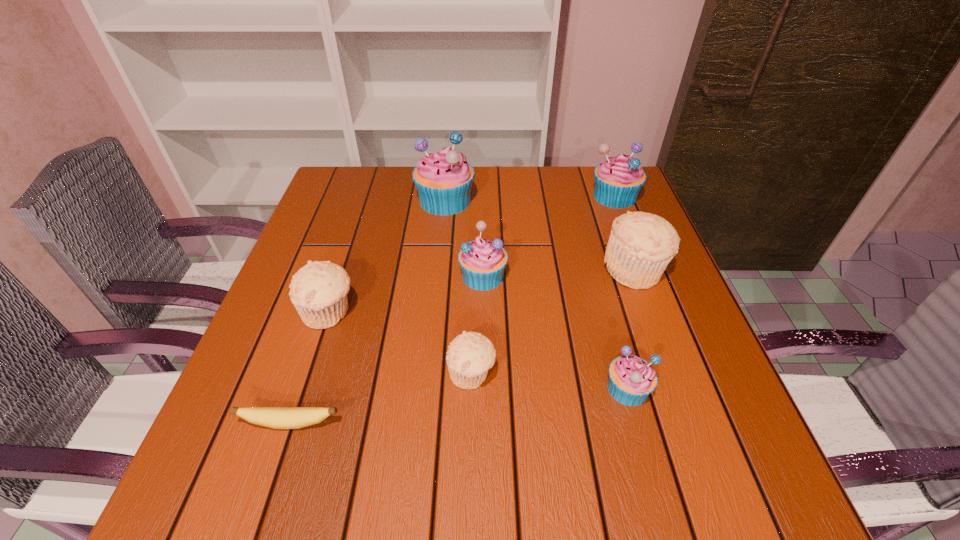
Select which muffin is the third closest to the biggest blue muffin. Please provide its 2D coordinates. Your answer should be formatted as a tuple, i.e. [(x, y)], where the tuple contains the x and y coordinates of a point satisfying the conditions above.

[(641, 245)]

Identify which muffin is located as the fourth nearest to the nearest blue muffin. Please provide its 2D coordinates. Your answer should be formatted as a tuple, i.e. [(x, y)], where the tuple contains the x and y coordinates of a point satisfying the conditions above.

[(318, 291)]

Locate which blue muffin is the closest to the tallest muffin. Please provide its 2D coordinates. Your answer should be formatted as a tuple, i.e. [(x, y)], where the tuple contains the x and y coordinates of a point satisfying the conditions above.

[(482, 262)]

Where is `blue muffin that is the third closest one to the second beige muffin from left to right`? The width and height of the screenshot is (960, 540). blue muffin that is the third closest one to the second beige muffin from left to right is located at coordinates (443, 179).

The image size is (960, 540). What are the coordinates of `the second closest beige muffin to the leftmost muffin` in the screenshot? It's located at (641, 245).

Locate which beige muffin is the closest to the second biggest beige muffin. Please provide its 2D coordinates. Your answer should be formatted as a tuple, i.e. [(x, y)], where the tuple contains the x and y coordinates of a point satisfying the conditions above.

[(470, 355)]

Locate an element on the screen. Image resolution: width=960 pixels, height=540 pixels. vacant space that satisfies the following two spatial constraints: 1. on the back side of the rightmost blue muffin; 2. on the left side of the biggest beige muffin is located at coordinates (608, 196).